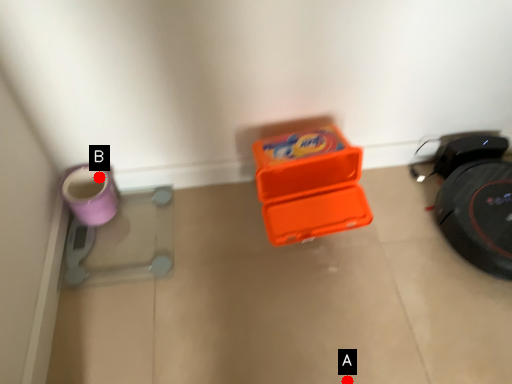
Question: Two points are circled on the image, labeled by A and B beside each circle. Which point is farther to the camera?

Choices:
 (A) A is further
 (B) B is further

Answer: (B)